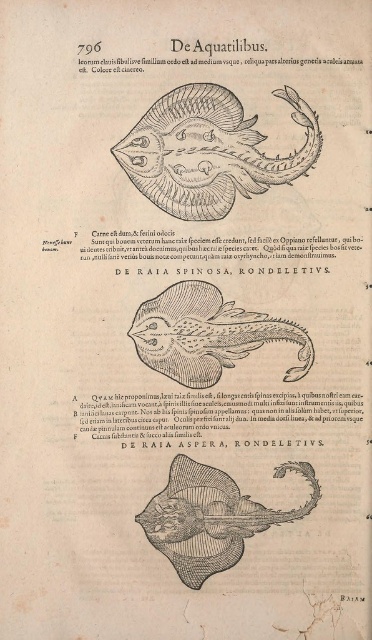
You are a book conservator working on a fragile historical text. You need to carefully measure the space between the two black papers at the bottom of the page to ensure proper preservation. Given that the allowable distance for preservation standards is 16 inches, is the current distance between the black paper at lower center and black paper at lower right within the required range?

The distance between the black paper at lower center and black paper at lower right is 16.45 inches, which exceeds the allowable 16 inches. Therefore, the current distance is outside the required preservation standards.